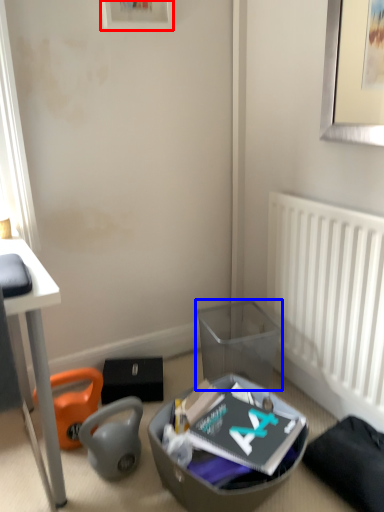
Question: Which point is further to the camera, picture frame (highlighted by a red box) or trash bin/can (highlighted by a blue box)?

Choices:
 (A) picture frame
 (B) trash bin/can

Answer: (B)